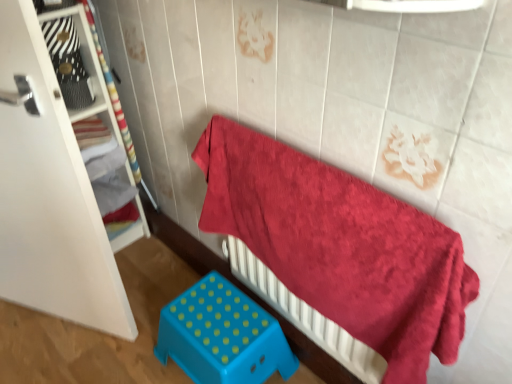
Question: Is blue plastic stool at lower center bigger than fluffy red towel at upper right?

Choices:
 (A) yes
 (B) no

Answer: (B)

Question: From the image's perspective, is blue plastic stool at lower center beneath fluffy red towel at upper right?

Choices:
 (A) yes
 (B) no

Answer: (A)

Question: Can you confirm if blue plastic stool at lower center is wider than fluffy red towel at upper right?

Choices:
 (A) no
 (B) yes

Answer: (B)

Question: Does blue plastic stool at lower center have a smaller size compared to fluffy red towel at upper right?

Choices:
 (A) yes
 (B) no

Answer: (A)

Question: From the image's perspective, does blue plastic stool at lower center appear higher than fluffy red towel at upper right?

Choices:
 (A) yes
 (B) no

Answer: (B)

Question: Would you say blue plastic stool at lower center is to the left or to the right of fluffy red towel at upper right in the picture?

Choices:
 (A) right
 (B) left

Answer: (B)

Question: From the image's perspective, is blue plastic stool at lower center positioned above or below fluffy red towel at upper right?

Choices:
 (A) above
 (B) below

Answer: (B)

Question: Do you think blue plastic stool at lower center is within fluffy red towel at upper right, or outside of it?

Choices:
 (A) inside
 (B) outside

Answer: (B)

Question: Considering the positions of point (244, 311) and point (398, 302), is point (244, 311) closer or farther from the camera than point (398, 302)?

Choices:
 (A) closer
 (B) farther

Answer: (B)

Question: Is white wood shelf at left wider or thinner than fluffy red towel at upper right?

Choices:
 (A) thin
 (B) wide

Answer: (B)

Question: Would you say white wood shelf at left is to the left or to the right of fluffy red towel at upper right in the picture?

Choices:
 (A) left
 (B) right

Answer: (A)

Question: Considering the positions of point (82, 29) and point (377, 301), is point (82, 29) closer or farther from the camera than point (377, 301)?

Choices:
 (A) farther
 (B) closer

Answer: (A)

Question: From the image's perspective, is white wood shelf at left positioned above or below fluffy red towel at upper right?

Choices:
 (A) below
 (B) above

Answer: (B)

Question: From a real-world perspective, is blue plastic stool at lower center physically located above or below white wood shelf at left?

Choices:
 (A) below
 (B) above

Answer: (A)

Question: Looking at their shapes, would you say blue plastic stool at lower center is wider or thinner than white wood shelf at left?

Choices:
 (A) thin
 (B) wide

Answer: (A)